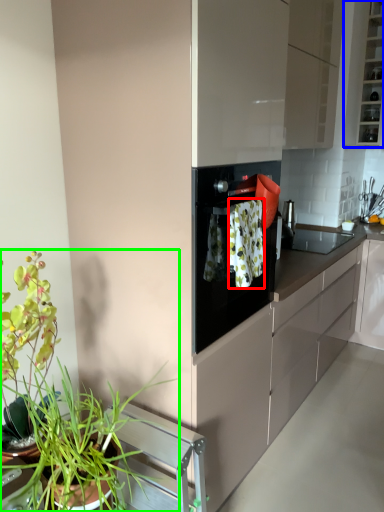
Question: Which object is positioned farthest from laundry (highlighted by a red box)? Select from cabinetry (highlighted by a blue box) and houseplant (highlighted by a green box).

Choices:
 (A) cabinetry
 (B) houseplant

Answer: (A)